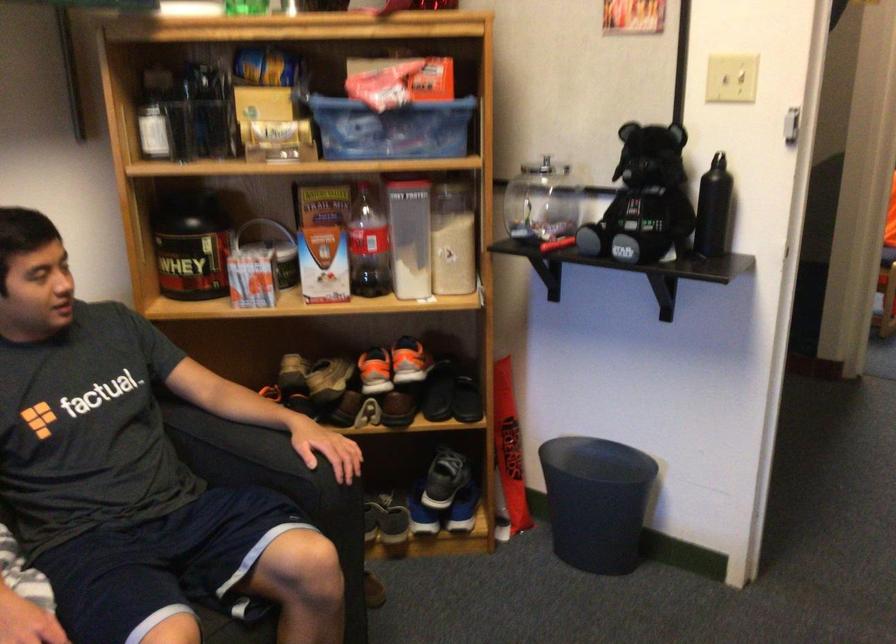
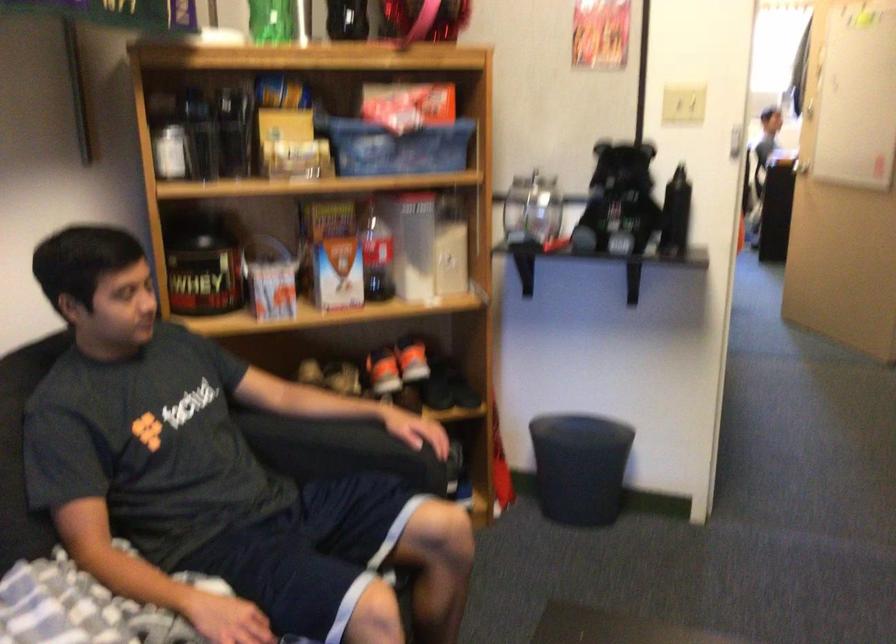
The point at (721, 88) is marked in the first image. Where is the corresponding point in the second image?

(682, 106)